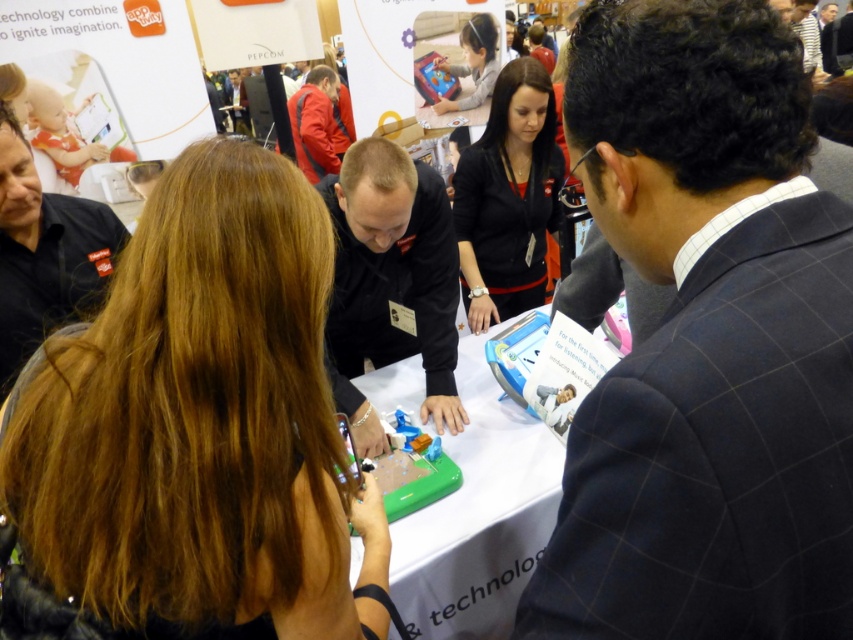
Question: Estimate the real-world distances between objects in this image. Which object is closer to the black matte shirt at center?

Choices:
 (A) dark blue checkered suit at center
 (B) black matte jacket at center

Answer: (B)

Question: Can you confirm if black matte shirt at center is positioned to the right of black matte jacket at center?

Choices:
 (A) yes
 (B) no

Answer: (B)

Question: Which of these objects is positioned closest to the dark blue checkered suit at center?

Choices:
 (A) green plastic table at center
 (B) black matte shirt at left
 (C) matte black tablet at upper center

Answer: (A)

Question: Which point appears closest to the camera in this image?

Choices:
 (A) (0, 292)
 (B) (751, 332)
 (C) (494, 500)

Answer: (B)

Question: Where is brown hair at center located in relation to black matte shirt at left in the image?

Choices:
 (A) above
 (B) below

Answer: (B)

Question: Is brown hair at center thinner than black matte jacket at center?

Choices:
 (A) no
 (B) yes

Answer: (A)